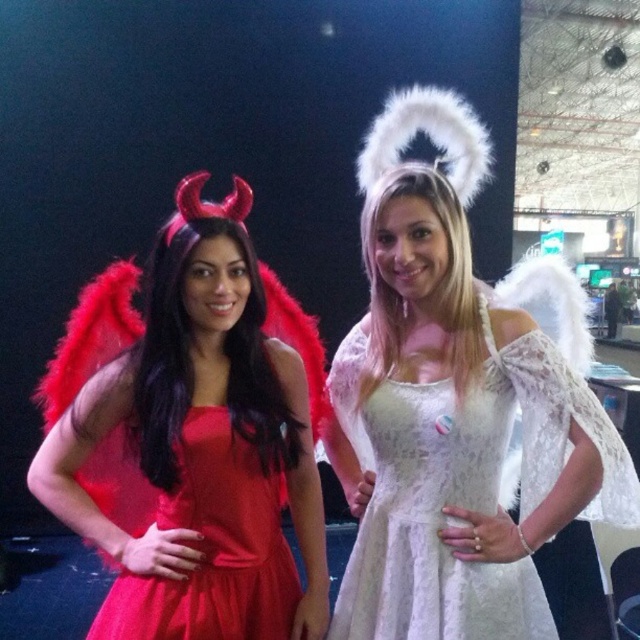
Question: Is matte red dress at left smaller than lace white dress at center?

Choices:
 (A) no
 (B) yes

Answer: (B)

Question: Estimate the real-world distances between objects in this image. Which object is closer to the matte red dress at center?

Choices:
 (A) lace white dress at center
 (B) matte red dress at left

Answer: (B)

Question: Estimate the real-world distances between objects in this image. Which object is farther from the matte red dress at center?

Choices:
 (A) matte red dress at left
 (B) lace white dress at center

Answer: (B)

Question: Can you confirm if matte red dress at left is smaller than lace white dress at center?

Choices:
 (A) no
 (B) yes

Answer: (B)

Question: Which point is closer to the camera taking this photo?

Choices:
 (A) (520, 602)
 (B) (156, 432)

Answer: (B)

Question: Does matte red dress at left have a greater width compared to matte red dress at center?

Choices:
 (A) yes
 (B) no

Answer: (A)